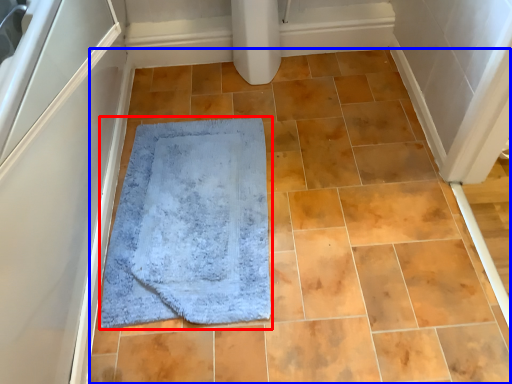
Question: Which object is further to the camera taking this photo, bath mat (highlighted by a red box) or ceramic tile (highlighted by a blue box)?

Choices:
 (A) bath mat
 (B) ceramic tile

Answer: (A)